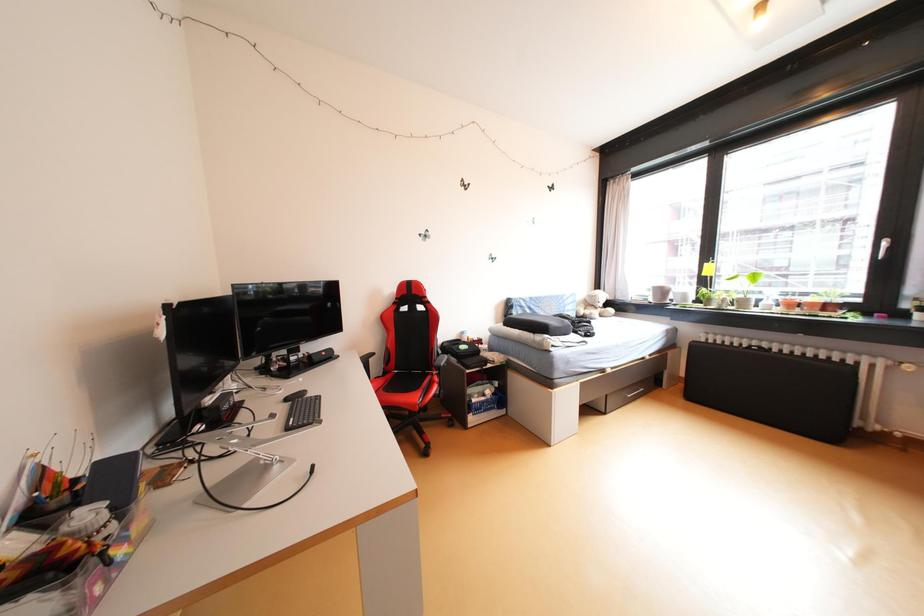
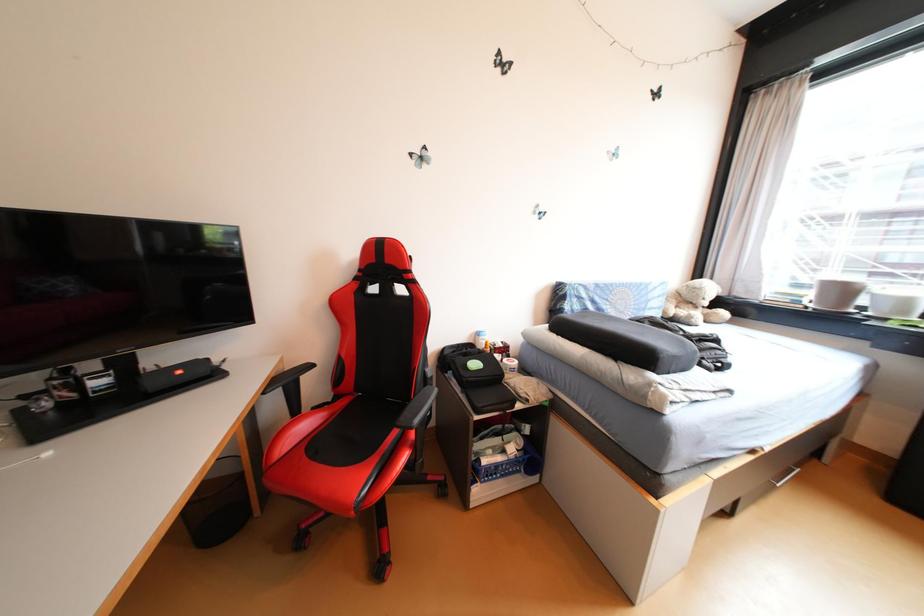
Question: The images are taken continuously from a first-person perspective. In which direction are you moving?

Choices:
 (A) Left
 (B) Right
 (C) Forward
 (D) Backward

Answer: (C)